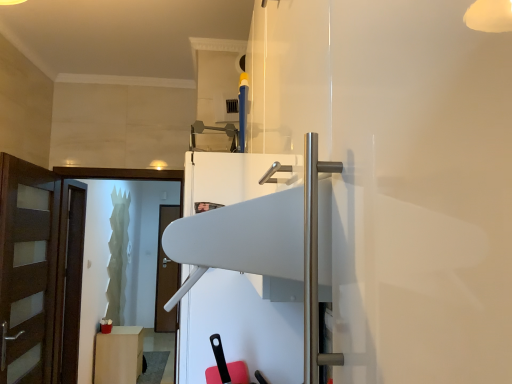
Question: Does white glossy fridge at center lie in front of brown wooden door at left?

Choices:
 (A) no
 (B) yes

Answer: (B)

Question: From the image's perspective, is white glossy fridge at center located above brown wooden door at left?

Choices:
 (A) no
 (B) yes

Answer: (B)

Question: From a real-world perspective, is white glossy fridge at center physically below brown wooden door at left?

Choices:
 (A) yes
 (B) no

Answer: (B)

Question: Is white glossy fridge at center at the right side of brown wooden door at left?

Choices:
 (A) no
 (B) yes

Answer: (B)

Question: Does white glossy fridge at center have a lesser width compared to brown wooden door at left?

Choices:
 (A) no
 (B) yes

Answer: (A)

Question: From a real-world perspective, is white glossy fridge at center over brown wooden door at left?

Choices:
 (A) no
 (B) yes

Answer: (B)

Question: Is brown wooden door at left turned away from matte white cabinet at lower left?

Choices:
 (A) yes
 (B) no

Answer: (B)

Question: From a real-world perspective, is brown wooden door at left positioned over matte white cabinet at lower left based on gravity?

Choices:
 (A) no
 (B) yes

Answer: (B)

Question: Can you confirm if brown wooden door at left is bigger than matte white cabinet at lower left?

Choices:
 (A) no
 (B) yes

Answer: (B)

Question: Considering the relative positions of brown wooden door at left and matte white cabinet at lower left in the image provided, is brown wooden door at left in front of matte white cabinet at lower left?

Choices:
 (A) no
 (B) yes

Answer: (B)

Question: Is brown wooden door at left aimed at matte white cabinet at lower left?

Choices:
 (A) yes
 (B) no

Answer: (B)

Question: Can you confirm if brown wooden door at left is shorter than matte white cabinet at lower left?

Choices:
 (A) no
 (B) yes

Answer: (A)

Question: From a real-world perspective, is matte white cabinet at lower left physically above transparent glass screen door at left?

Choices:
 (A) no
 (B) yes

Answer: (A)